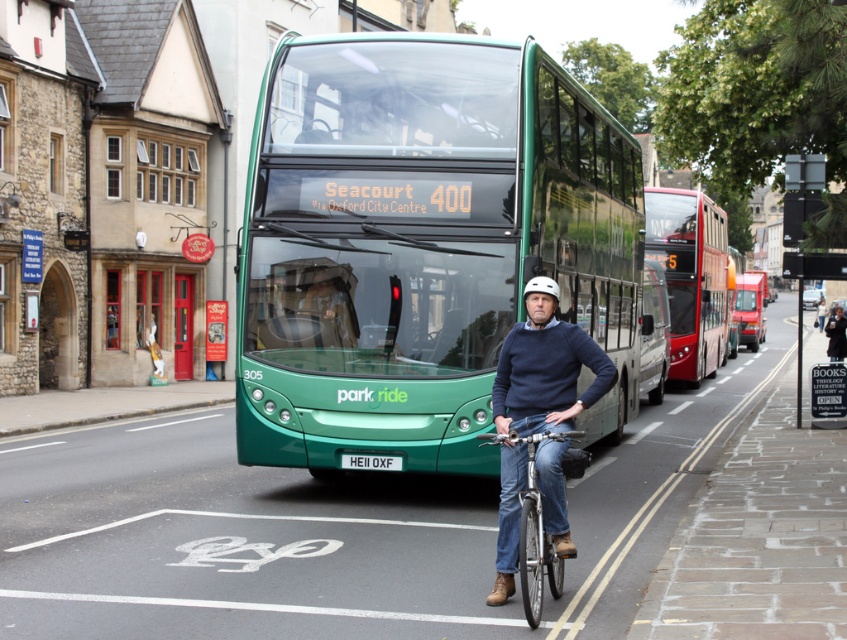
Question: Which point is farther from the camera taking this photo?

Choices:
 (A) (430, 392)
 (B) (690, 237)
 (C) (743, 321)

Answer: (C)

Question: Which point is farther from the camera taking this photo?

Choices:
 (A) (486, 369)
 (B) (671, 192)
 (C) (399, 467)

Answer: (B)

Question: From the image, what is the correct spatial relationship of green rubber bike lane at center in relation to black metal sign at right?

Choices:
 (A) left
 (B) right

Answer: (A)

Question: Is metallic silver bicycle at center in front of white plastic license plate at center?

Choices:
 (A) yes
 (B) no

Answer: (A)

Question: Estimate the real-world distances between objects in this image. Which object is farther from the denim jeans at center?

Choices:
 (A) green rubber bike lane at center
 (B) white plastic license plate at center
 (C) green metallic bus at center

Answer: (B)

Question: Is red metallic bus at right above black metal sign at right?

Choices:
 (A) yes
 (B) no

Answer: (A)